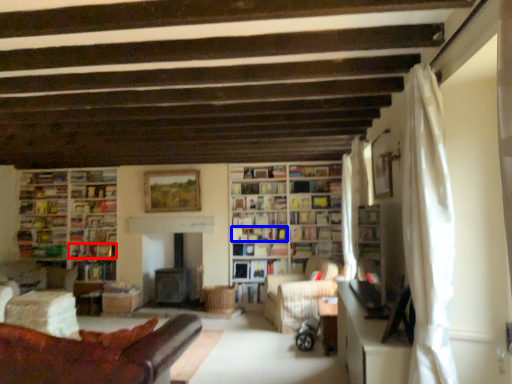
Question: Which object is closer to the camera taking this photo, book (highlighted by a red box) or book (highlighted by a blue box)?

Choices:
 (A) book
 (B) book

Answer: (B)